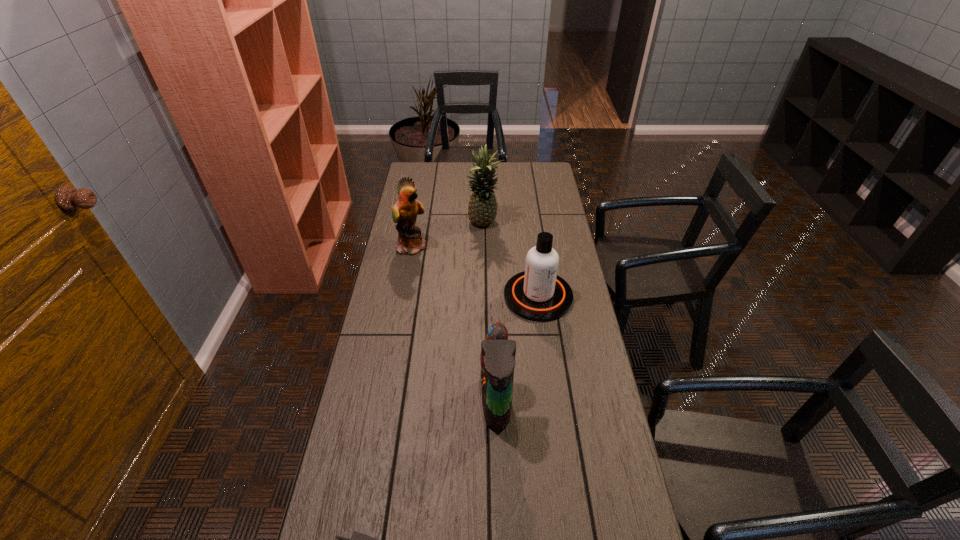
This screenshot has height=540, width=960. What are the coordinates of `vacant region that satisfies the following two spatial constraints: 1. on the front side of the third farthest object; 2. at the face of the shorter parrot` in the screenshot? It's located at (552, 402).

Identify the location of vacant area that satisfies the following two spatial constraints: 1. on the front side of the cleansing agent; 2. on the left side of the pineapple. point(484,296).